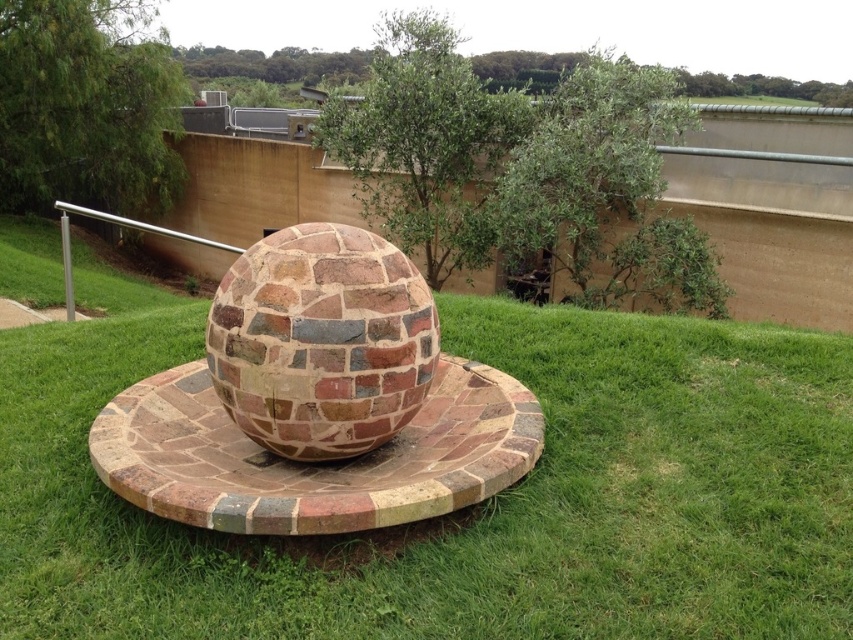
Question: Is green grass at center positioned before brick-patterned sphere at center?

Choices:
 (A) no
 (B) yes

Answer: (B)

Question: Does green grass at center have a smaller size compared to brick-patterned sphere at center?

Choices:
 (A) yes
 (B) no

Answer: (B)

Question: Among these points, which one is farthest from the camera?

Choices:
 (A) (296, 416)
 (B) (13, 504)

Answer: (B)

Question: Can you confirm if green grass at center is wider than brick-patterned sphere at center?

Choices:
 (A) yes
 (B) no

Answer: (A)

Question: Which point is closer to the camera?

Choices:
 (A) (572, 452)
 (B) (399, 317)

Answer: (B)